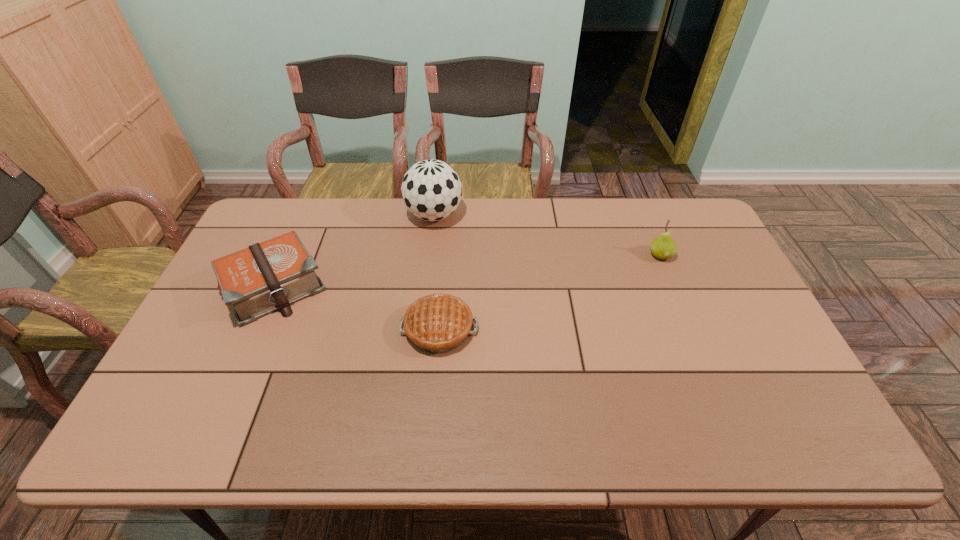
Image resolution: width=960 pixels, height=540 pixels. What are the coordinates of `free space between the farthest object and the rightmost object` in the screenshot? It's located at (547, 235).

Identify the location of free space that is in between the Bible and the tallest object. (354, 251).

You are a GUI agent. You are given a task and a screenshot of the screen. Output one action in this format:
    pyautogui.click(x=<x>, y=<y>)
    Task: Click on the free point between the pear and the farthest object
    
    Given the screenshot: What is the action you would take?
    pyautogui.click(x=547, y=235)

Find the location of a particular element. free space between the pear and the second shortest object is located at coordinates (468, 271).

You are a GUI agent. You are given a task and a screenshot of the screen. Output one action in this format:
    pyautogui.click(x=<x>, y=<y>)
    Task: Click on the empty space that is in between the soccer ball and the shortest object
    This screenshot has height=540, width=960.
    Given the screenshot: What is the action you would take?
    pyautogui.click(x=437, y=272)

Where is `vacant space that's between the leftmost object and the soccer ball`? vacant space that's between the leftmost object and the soccer ball is located at coordinates (354, 251).

At what (x,y) coordinates should I click in order to perform the action: click on vacant area that lies between the shortest object and the tallest object. Please return your answer as a coordinate pair (x, y). The image size is (960, 540). Looking at the image, I should click on (437, 272).

Locate which object ranks third in proximity to the soccer ball. Please provide its 2D coordinates. Your answer should be formatted as a tuple, i.e. [(x, y)], where the tuple contains the x and y coordinates of a point satisfying the conditions above.

[(663, 247)]

This screenshot has height=540, width=960. Identify the location of object that is the second closest to the second tallest object. (431, 190).

The height and width of the screenshot is (540, 960). In order to click on vacant space that satisfies the following two spatial constraints: 1. on the front side of the farthest object; 2. on the left side of the shortest object in this screenshot , I will do `click(420, 328)`.